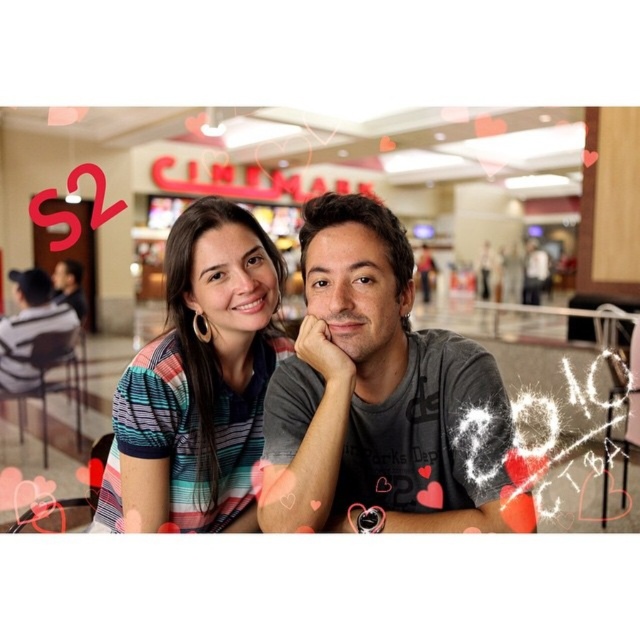
Question: Does matte gray shirt at center have a greater width compared to matte gray shirt at left?

Choices:
 (A) no
 (B) yes

Answer: (B)

Question: Does striped fabric at center lie in front of matte gray shirt at left?

Choices:
 (A) no
 (B) yes

Answer: (B)

Question: Which object appears closest to the camera in this image?

Choices:
 (A) matte gray shirt at center
 (B) matte gray shirt at left
 (C) striped fabric at center

Answer: (C)

Question: Which of these objects is positioned closest to the striped fabric at center?

Choices:
 (A) matte gray shirt at left
 (B) gray cotton t-shirt at center

Answer: (B)

Question: Can you confirm if gray cotton t-shirt at center is wider than matte gray shirt at left?

Choices:
 (A) yes
 (B) no

Answer: (A)

Question: Which of the following is the closest to the observer?

Choices:
 (A) (230, 339)
 (B) (12, 349)
 (C) (248, 152)
 (D) (292, 451)

Answer: (D)